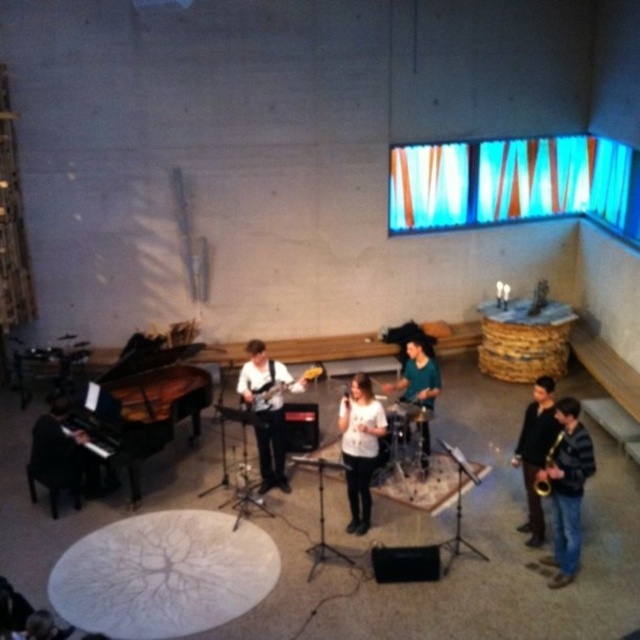
Question: Which point is closer to the camera taking this photo?

Choices:
 (A) (65, 403)
 (B) (282, 394)
 (C) (92, 442)
 (D) (548, 481)

Answer: (D)

Question: Can you confirm if matte black guitar at center is bigger than teal fabric shirt at center?

Choices:
 (A) no
 (B) yes

Answer: (B)

Question: Is white matte shirt at center smaller than black matte saxophone at lower right?

Choices:
 (A) yes
 (B) no

Answer: (B)

Question: Which point is farther to the camera?

Choices:
 (A) black matte saxophone at lower right
 (B) black polished piano at left
 (C) matte black guitar at center

Answer: (C)

Question: Is black piano at left closer to camera compared to black matte saxophone at lower right?

Choices:
 (A) no
 (B) yes

Answer: (A)

Question: Which object is positioned farthest from the matte black electric guitar at center?

Choices:
 (A) gold metallic saxophone at lower right
 (B) black matte saxophone at lower right

Answer: (A)